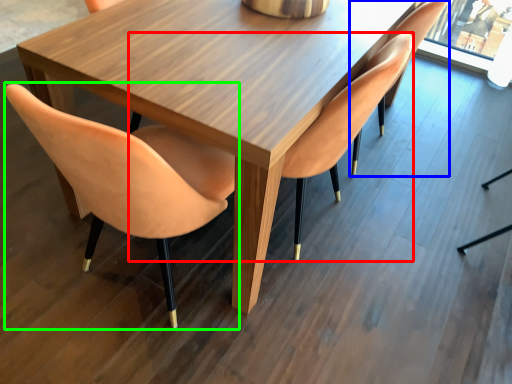
Question: Which object is the closest to the chair (highlighted by a red box)? Choose among these: chair (highlighted by a blue box) or chair (highlighted by a green box).

Choices:
 (A) chair
 (B) chair

Answer: (A)